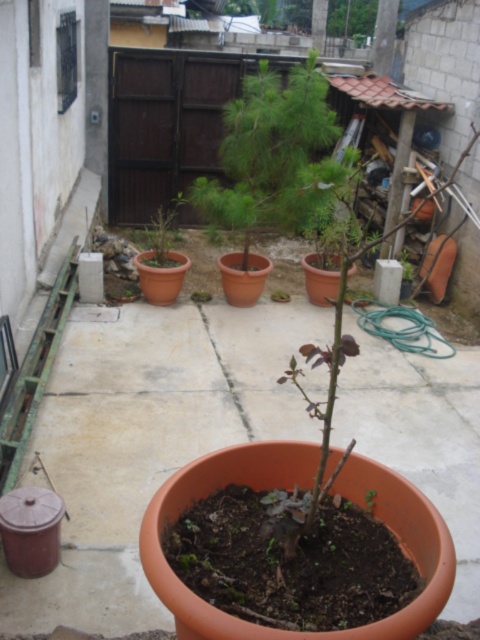
You are standing in the backyard and want to place a new potted plant exactly at the point marked by coordinates (272, 154). What object is currently located at that spot?

The green matte tree at center is located at point (272, 154).

You are a gardener who wants to ensure proper sunlight for the green matte tree at center and the matte clay pot at center. Since the tree is taller, will its shadow block the sunlight reaching the pot?

The green matte tree at center is taller than the matte clay pot at center, so its shadow will likely block sunlight from reaching the pot.